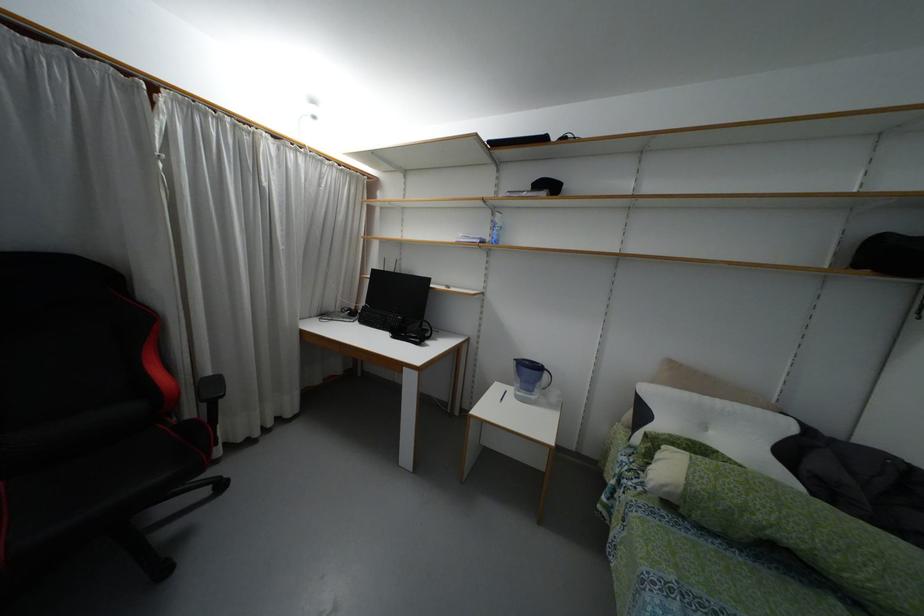
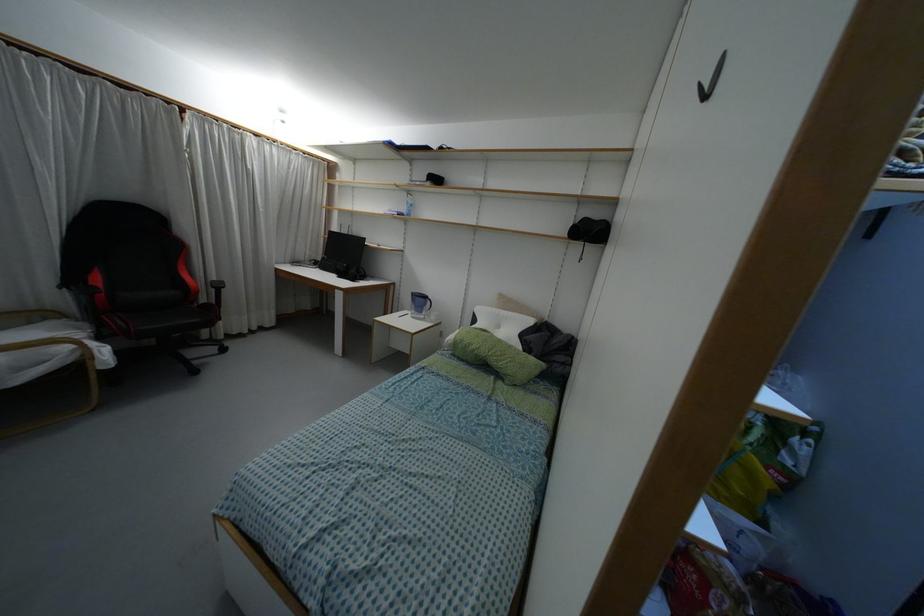
Locate, in the second image, the point that corresponds to [687,483] in the first image.

(455, 337)